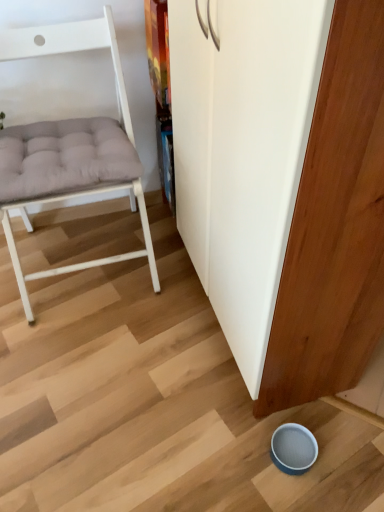
Looking at this image, what is the approximate height of white matte chair at left?

white matte chair at left is 31.40 inches tall.

This screenshot has width=384, height=512. What do you see at coordinates (71, 50) in the screenshot?
I see `white matte chair at left` at bounding box center [71, 50].

The image size is (384, 512). In order to click on white matte chair at left in this screenshot , I will do `click(71, 50)`.

I want to click on white matte chair at left, so click(71, 50).